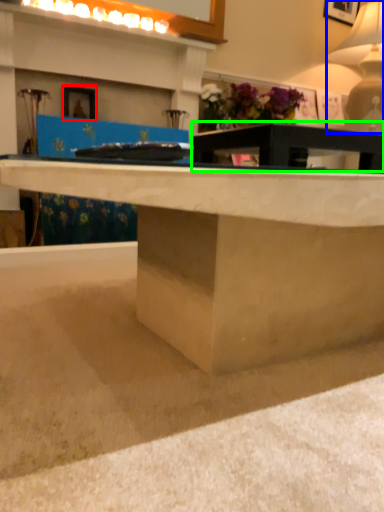
Question: Estimate the real-world distances between objects in this image. Which object is closer to picture frame (highlighted by a red box), table lamp (highlighted by a blue box) or table (highlighted by a green box)?

Choices:
 (A) table lamp
 (B) table

Answer: (B)